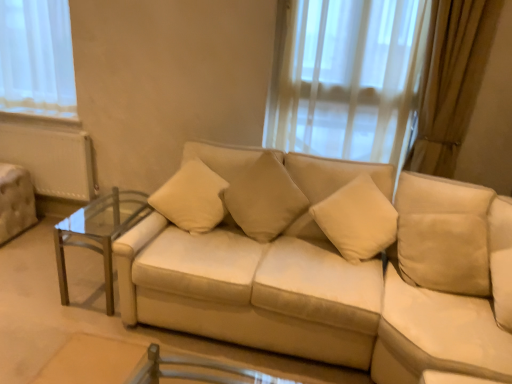
Question: From a real-world perspective, is beige fabric pillow at center, the 2th pillow in the right-to-left sequence, on top of beige fabric pillow at center, placed as the 1th pillow when sorted from right to left?

Choices:
 (A) yes
 (B) no

Answer: (B)

Question: Considering the relative sizes of beige fabric pillow at center, the 2th pillow in the right-to-left sequence, and beige fabric pillow at center, marked as the 2th pillow in a left-to-right arrangement, in the image provided, is beige fabric pillow at center, the 2th pillow in the right-to-left sequence, smaller than beige fabric pillow at center, marked as the 2th pillow in a left-to-right arrangement,?

Choices:
 (A) yes
 (B) no

Answer: (A)

Question: From the image's perspective, is beige fabric pillow at center, the 1th pillow from the left, beneath beige fabric pillow at center, placed as the 1th pillow when sorted from right to left?

Choices:
 (A) no
 (B) yes

Answer: (A)

Question: Is beige fabric pillow at center, the 2th pillow in the right-to-left sequence, wider than beige fabric pillow at center, placed as the 1th pillow when sorted from right to left?

Choices:
 (A) yes
 (B) no

Answer: (A)

Question: Can you confirm if beige fabric pillow at center, the 1th pillow from the left, is taller than beige fabric pillow at center, marked as the 2th pillow in a left-to-right arrangement?

Choices:
 (A) no
 (B) yes

Answer: (A)

Question: From a real-world perspective, is beige fabric pillow at center, the 2th pillow in the right-to-left sequence, positioned above or below beige suede swivel chair at right?

Choices:
 (A) below
 (B) above

Answer: (B)

Question: Looking at their shapes, would you say beige fabric pillow at center, the 1th pillow from the left, is wider or thinner than beige suede swivel chair at right?

Choices:
 (A) thin
 (B) wide

Answer: (A)

Question: From the image's perspective, is beige fabric pillow at center, the 1th pillow from the left, above or below beige suede swivel chair at right?

Choices:
 (A) above
 (B) below

Answer: (A)

Question: Considering their positions, is beige fabric pillow at center, the 1th pillow from the left, located in front of or behind beige suede swivel chair at right?

Choices:
 (A) behind
 (B) front

Answer: (A)

Question: Does point (123, 309) appear closer or farther from the camera than point (418, 319)?

Choices:
 (A) closer
 (B) farther

Answer: (B)

Question: Is beige suede couch at center inside or outside of beige suede swivel chair at right?

Choices:
 (A) outside
 (B) inside

Answer: (A)

Question: In terms of height, does beige suede couch at center look taller or shorter compared to beige suede swivel chair at right?

Choices:
 (A) short
 (B) tall

Answer: (B)

Question: Is beige suede couch at center in front of or behind beige suede swivel chair at right in the image?

Choices:
 (A) behind
 (B) front

Answer: (B)

Question: From a real-world perspective, is beige suede swivel chair at right positioned above or below beige suede couch at center?

Choices:
 (A) above
 (B) below

Answer: (A)

Question: From the image's perspective, is beige suede swivel chair at right positioned above or below beige suede couch at center?

Choices:
 (A) below
 (B) above

Answer: (A)